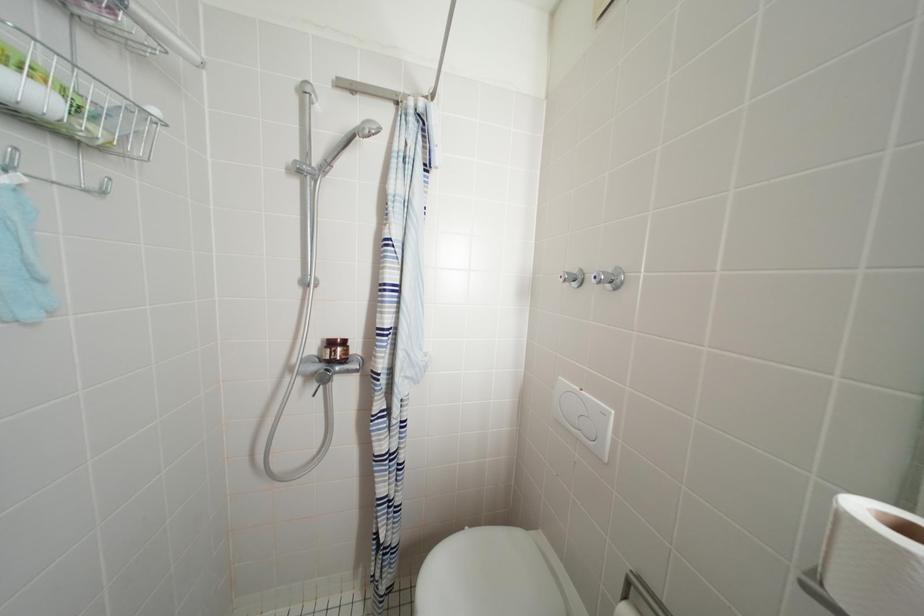
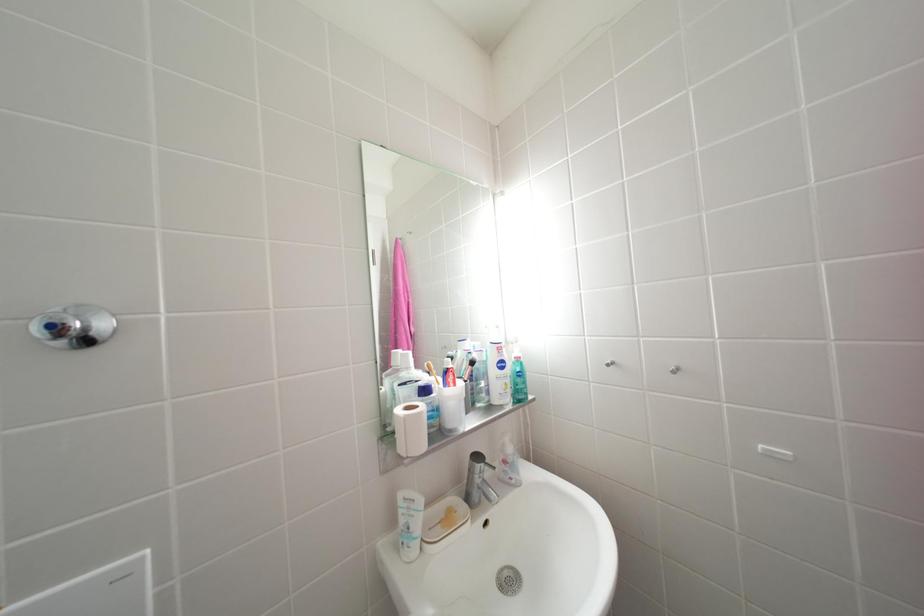
Question: Based on the continuous images, in which direction is the camera rotating? Reply with the corresponding letter.

Choices:
 (A) Left
 (B) Right
 (C) Up
 (D) Down

Answer: (B)